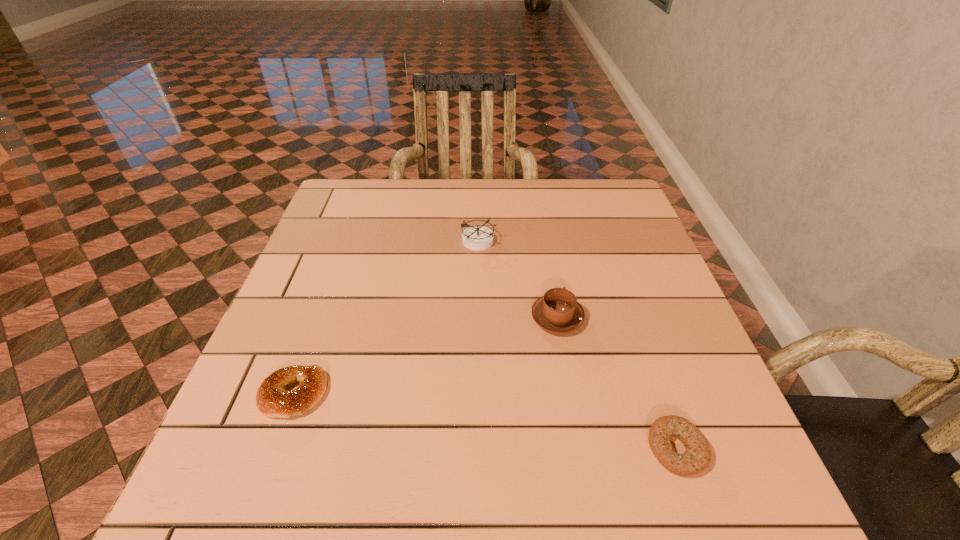
Find the location of a particular element. the farthest object is located at coordinates (477, 238).

What are the coordinates of `the third object from right to left` in the screenshot? It's located at (477, 238).

Image resolution: width=960 pixels, height=540 pixels. Identify the location of cappuccino. (558, 311).

You are a GUI agent. You are given a task and a screenshot of the screen. Output one action in this format:
    pyautogui.click(x=<x>, y=<y>)
    Task: Click on the third nearest object
    
    Given the screenshot: What is the action you would take?
    pyautogui.click(x=558, y=311)

Image resolution: width=960 pixels, height=540 pixels. I want to click on the left bagel, so click(x=272, y=399).

This screenshot has width=960, height=540. Identify the location of the right bagel. (696, 458).

Find the location of `free point located 0.350m on the front of the farthest object`. free point located 0.350m on the front of the farthest object is located at coordinates (479, 361).

Where is `free space located 0.210m on the side of the second object from right to left with the handle`? The height and width of the screenshot is (540, 960). free space located 0.210m on the side of the second object from right to left with the handle is located at coordinates (544, 243).

Where is `free space located 0.210m on the side of the second object from right to left with the handle`? The image size is (960, 540). free space located 0.210m on the side of the second object from right to left with the handle is located at coordinates (544, 243).

This screenshot has height=540, width=960. Find the location of `free space located on the side of the second object from right to left with the handle`. free space located on the side of the second object from right to left with the handle is located at coordinates (544, 243).